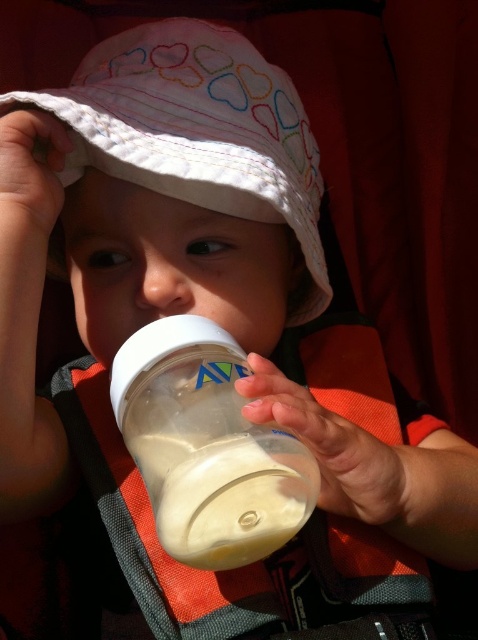
Between white cotton hat at upper center and transparent plastic bottle at center, which one appears on the left side from the viewer's perspective?

Positioned to the left is white cotton hat at upper center.

Consider the image. Is white cotton hat at upper center further to camera compared to transparent plastic bottle at center?

That is True.

Locate an element on the screen. white cotton hat at upper center is located at coordinates (196, 131).

You are a GUI agent. You are given a task and a screenshot of the screen. Output one action in this format:
    pyautogui.click(x=<x>, y=<y>)
    Task: Click on the white cotton hat at upper center
    This screenshot has width=478, height=640.
    Given the screenshot: What is the action you would take?
    pos(196,131)